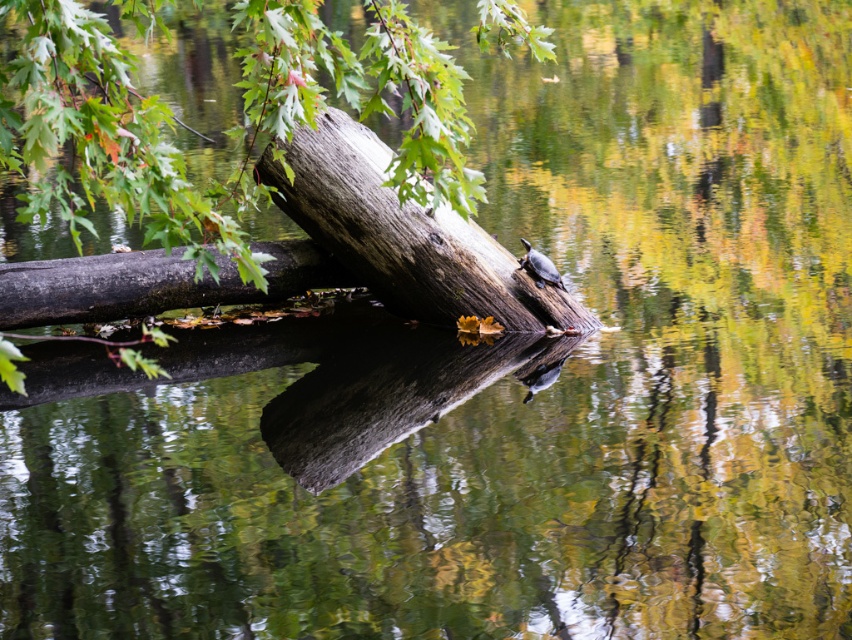
You are a hiker who wants to cross the water using the logs. You see the gray rough log at center and the brown rough tree trunk at center. Which one is higher above the water?

The gray rough log at center is above the brown rough tree trunk at center, so the gray rough log at center is higher above the water.

You are standing on the left side of the gray rough log at center and want to reach the brown rough tree trunk at center. Which direction should you move to get there?

The gray rough log at center is to the right of the brown rough tree trunk at center, so you should move to the left to reach the brown rough tree trunk at center.

You are a photographer standing at the edge of the water. You want to take a photo of the smooth brown log at center and the brown rough tree trunk at center such that both are clearly visible in the frame. Based on their positions, which object should you focus on first to ensure both are in focus?

You should focus on the brown rough tree trunk at center first because the smooth brown log at center is in front of it, so focusing on the background object ensures both are in focus.